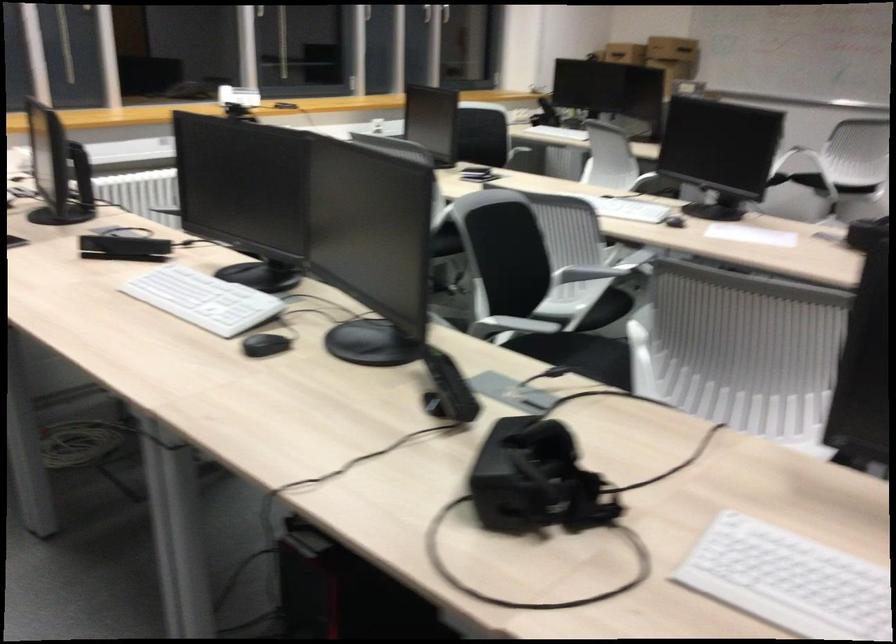
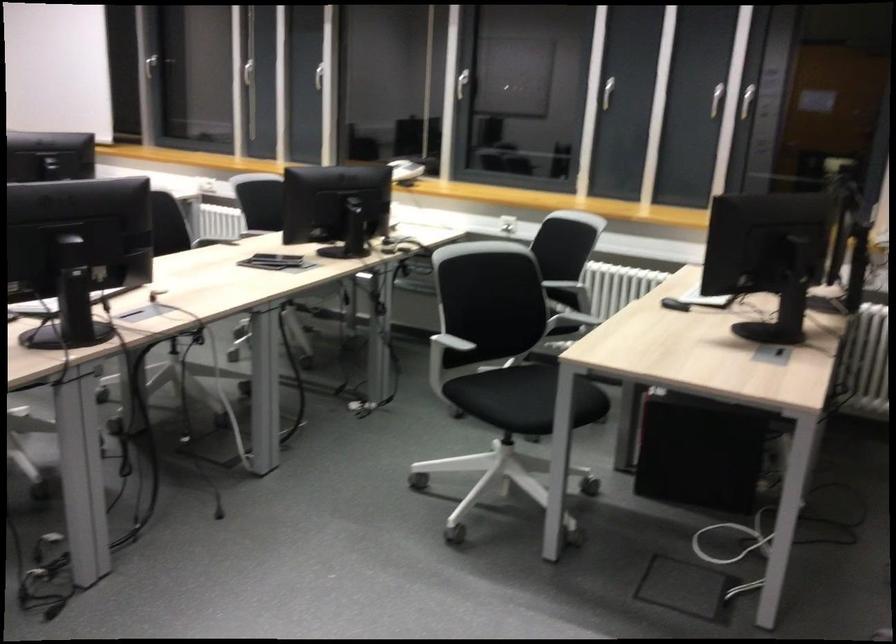
Question: I am providing you with two images of the same scene from different viewpoints. Which of the following objects are not visible in image2?

Choices:
 (A) white chair armrest
 (B) phone handset
 (C) chair sitting surface
 (D) white oval bin

Answer: (C)